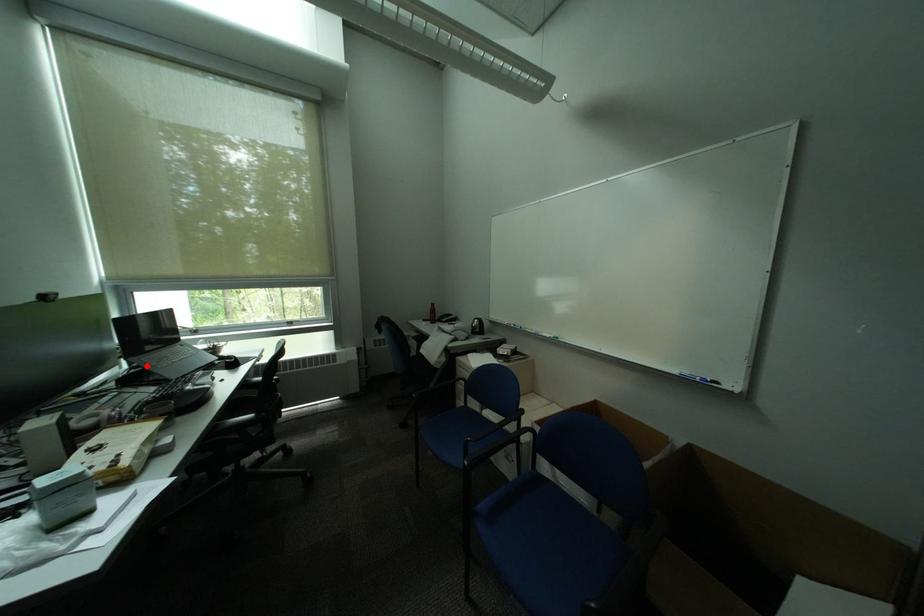
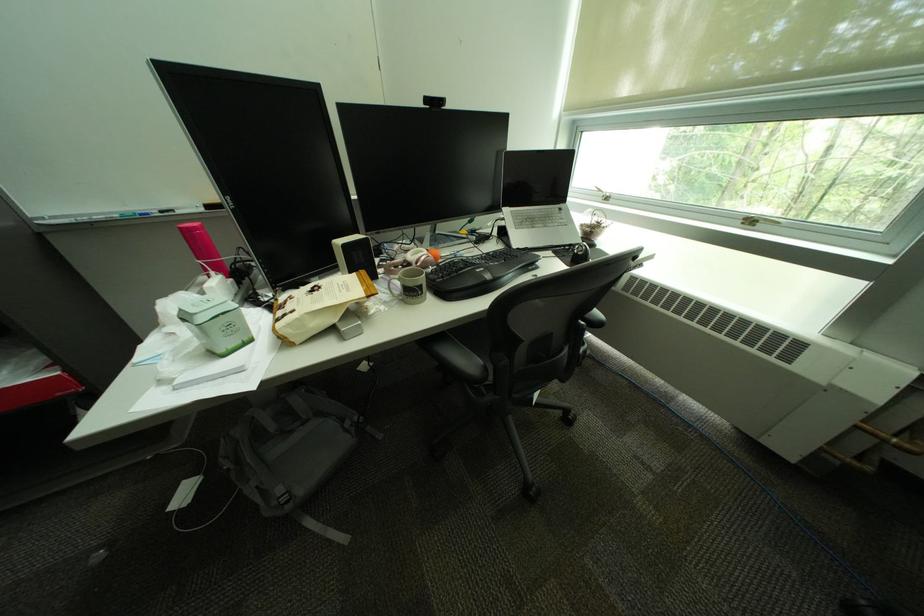
The point at the highlighted location is marked in the first image. Where is the corresponding point in the second image?

(514, 217)